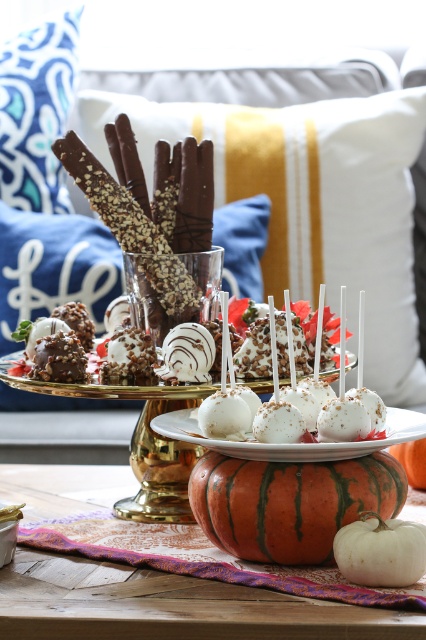
You are a guest at a dessert party and see two pumpkins on the dessert display. The orange pumpkin at center and the orange matte pumpkin at center. Which pumpkin is bigger?

The orange pumpkin at center is larger in size compared to the orange matte pumpkin at center.

You are setting up a Halloween display and have two pumpkins to place on a shelf. The shelf is exactly 12 inches wide. You have an orange pumpkin at center and an orange matte pumpkin at center. Which pumpkin should you choose to ensure it fits perfectly on the shelf without exceeding its width?

The orange pumpkin at center might be wider than orange matte pumpkin at center, so to ensure it fits perfectly on the shelf without exceeding its width, you should choose the orange matte pumpkin at center.

You are arranging a festive dessert display and need to place the white cotton pillow at upper center and the orange matte pumpkin at center. According to the scene description, where should you position the white cotton pillow relative to the orange matte pumpkin?

The white cotton pillow at upper center should be positioned to the right of the orange matte pumpkin at center.